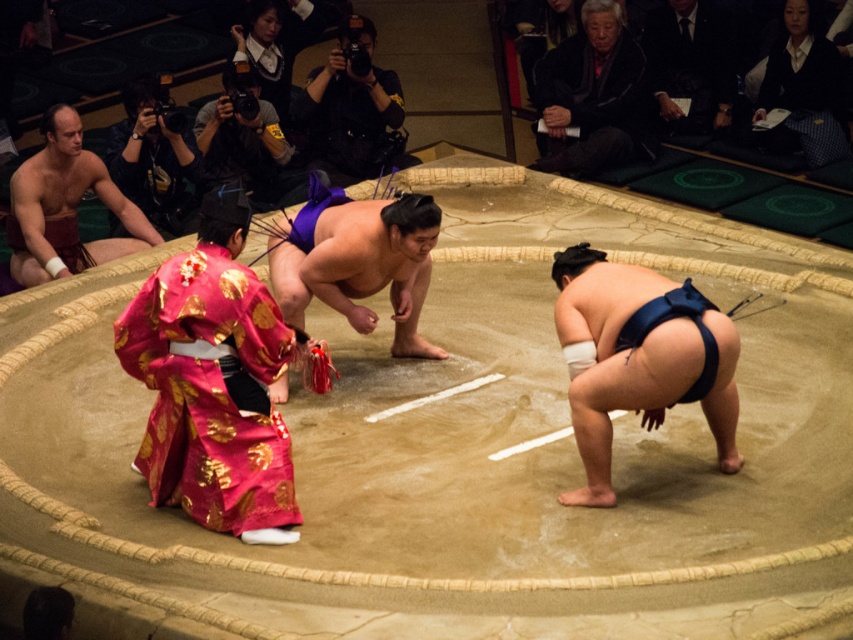
Based on the photo, you are a sumo referee observing the match from above. You notice two points marked in the dohyo. Which point is closer to your viewpoint? The points are point [543,65] and point [660,6].

Point [543,65] is closer to the viewer than point [660,6].

You are a photographer standing at the edge of the dohyo. You want to take a picture of the shiny pink kimono at lower left and the smooth maroon fabric at upper left. Which object will appear larger in your photo?

The shiny pink kimono at lower left will appear larger in the photo because it is much taller than the smooth maroon fabric at upper left.